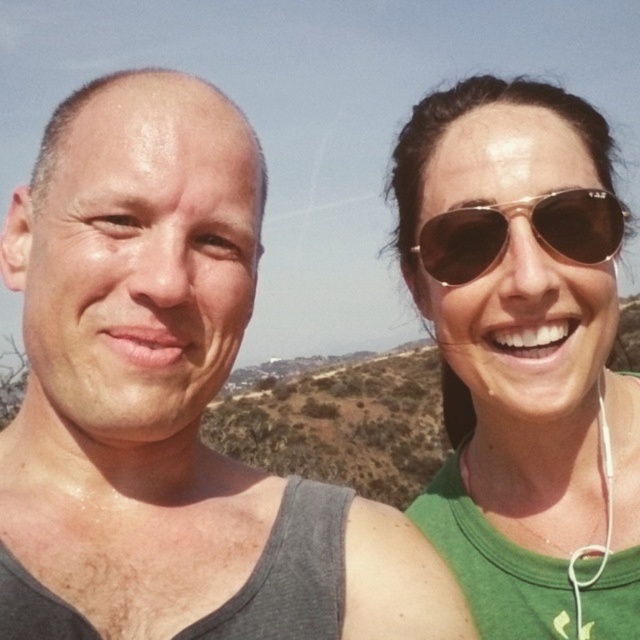
Does point (532, 376) come closer to viewer compared to point (483, 204)?

That is True.

Locate an element on the screen. The image size is (640, 640). matte gold sunglasses at upper right is located at coordinates (524, 355).

Which is in front, point (100, 106) or point (512, 531)?

Point (100, 106) is more forward.

Who is lower down, gray tank top at left or matte gold sunglasses at upper right?

Positioned lower is gray tank top at left.

Describe the element at coordinates (168, 403) in the screenshot. The width and height of the screenshot is (640, 640). I see `gray tank top at left` at that location.

This screenshot has height=640, width=640. I want to click on gray tank top at left, so click(168, 403).

Can you confirm if gray tank top at left is positioned to the left of brown reflective sunglasses at upper right?

Indeed, gray tank top at left is positioned on the left side of brown reflective sunglasses at upper right.

Does gray tank top at left appear under brown reflective sunglasses at upper right?

Yes, gray tank top at left is below brown reflective sunglasses at upper right.

Who is more forward, (316, 518) or (496, 237)?

Positioned in front is point (316, 518).

Find the location of a particular element. The image size is (640, 640). gray tank top at left is located at coordinates (168, 403).